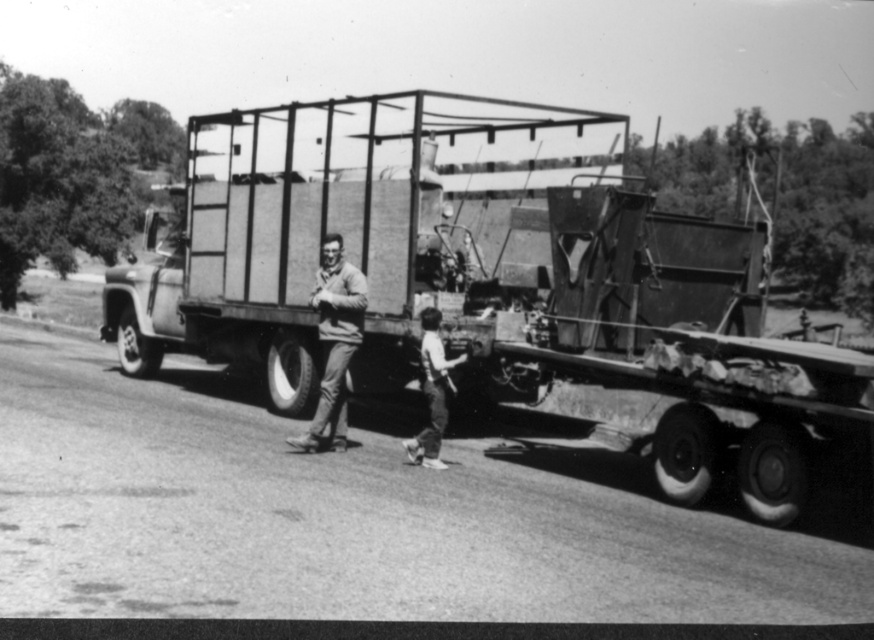
You are standing at the origin point of the image coordinate system. The truck is at coordinates 0.448, 0.571. If you want to walk directly to the metallic flatbed truck at center, which direction should you move in?

The metallic flatbed truck at center is located at coordinates (x=498, y=285). Since you are at the origin, you should move in the direction of increasing x and y coordinates to reach it.

You are a photographer standing at the back of the truck bed. You want to take a photo of the smooth beige sweater at center and the light brown hair at lower center. Can you fit both subjects into the frame without moving the camera? The camera has a 30 inch field of view.

The distance between the smooth beige sweater at center and the light brown hair at lower center is 38.75 inches. Since the camera has a 30 inch field of view, the photographer cannot fit both subjects into the frame without moving the camera because the distance between them exceeds the camera field of view.